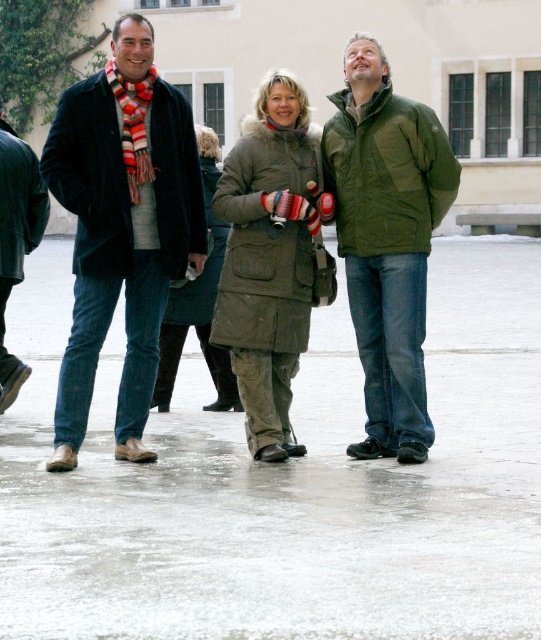
Based on the photo, you are a photographer trying to capture a group photo of the velvet black coat at left and the khaki canvas jacket at center. Since you want to ensure both are in focus, which one should you focus on first considering their positions?

The velvet black coat at left is in front of the khaki canvas jacket at center, so you should focus on the velvet black coat at left first to ensure both are in focus.

You are taking a photo of the three people in the scene. The two points you are focusing on are point (x=386, y=328) and point (x=267, y=241). Which point should you focus on to ensure the person closer to the camera is in focus?

Point (x=386, y=328) should be focused on because it is closer to the camera than point (x=267, y=241).